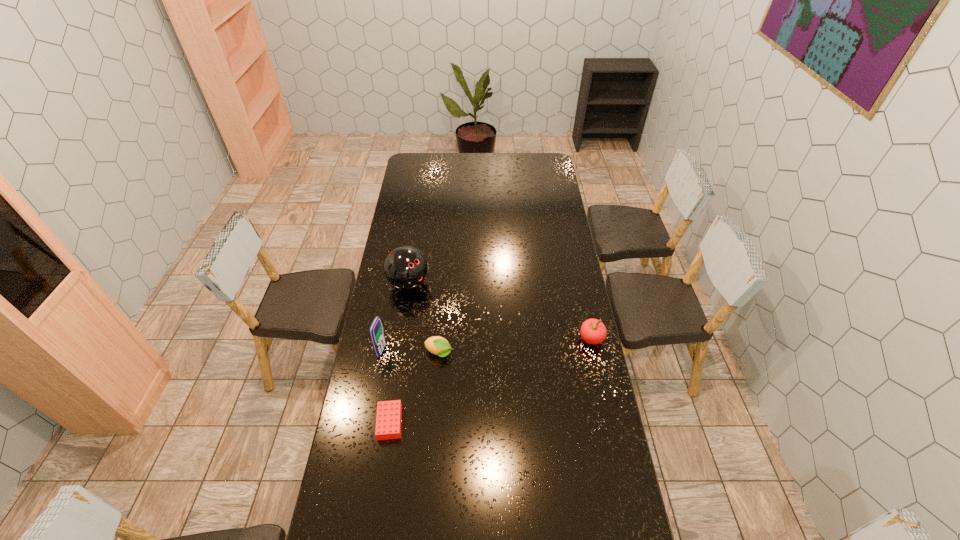
You are a GUI agent. You are given a task and a screenshot of the screen. Output one action in this format:
    pyautogui.click(x=<x>, y=<y>)
    Task: Click on the vacant space located 0.150m on the front-facing side of the cellular telephone
    This screenshot has width=960, height=540.
    Given the screenshot: What is the action you would take?
    pyautogui.click(x=422, y=361)

Identify the location of free spot located 0.160m on the front-facing side of the cellular telephone. The image size is (960, 540). (424, 361).

Locate an element on the screen. free location located on the front-facing side of the cellular telephone is located at coordinates (444, 365).

This screenshot has width=960, height=540. Find the location of `vacant region located 0.130m on the surface of the bowling ball near the finger holes`. vacant region located 0.130m on the surface of the bowling ball near the finger holes is located at coordinates (443, 310).

Where is `blank space located on the surface of the bowling ball near the finger holes`? The height and width of the screenshot is (540, 960). blank space located on the surface of the bowling ball near the finger holes is located at coordinates (459, 323).

Identify the location of vacant position located on the surface of the bowling ball near the finger holes. (430, 300).

Identify the location of blank space located with leaves positioned above the second shortest object. (501, 367).

I want to click on vacant region located 0.140m with leaves positioned above the second shortest object, so click(x=489, y=363).

Identify the location of vacant region located 0.370m with leaves positioned above the second shortest object. The height and width of the screenshot is (540, 960). (547, 378).

This screenshot has width=960, height=540. Identify the location of Lego present at the left edge. (389, 413).